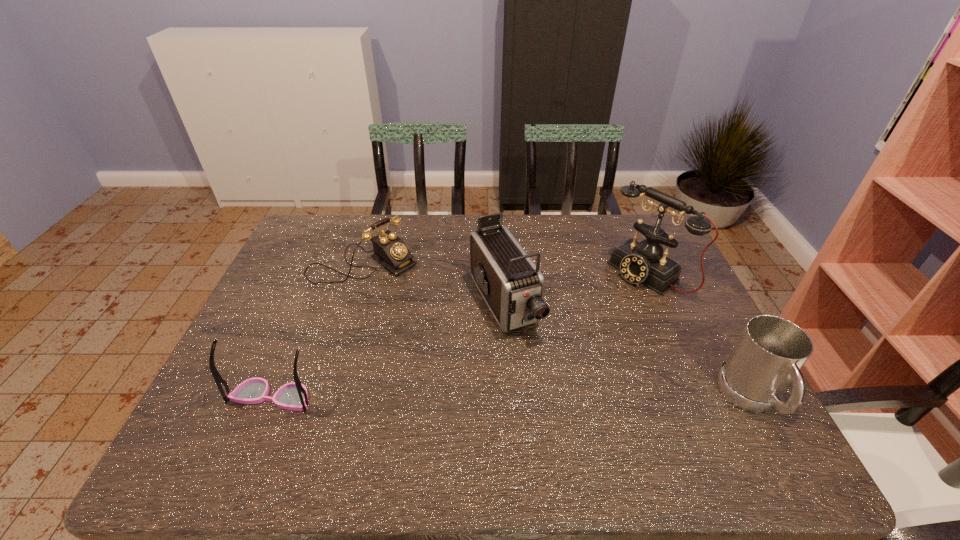
This screenshot has height=540, width=960. I want to click on blank region between the mug and the left telephone, so click(557, 332).

This screenshot has width=960, height=540. What are the coordinates of `object that is the closest to the spectacles` in the screenshot? It's located at (390, 251).

In order to click on object that is the third closest to the mug in this screenshot , I will do `click(390, 251)`.

Where is `vacant space that satisfies the following two spatial constraints: 1. on the back side of the camcorder; 2. on the left side of the right telephone`? vacant space that satisfies the following two spatial constraints: 1. on the back side of the camcorder; 2. on the left side of the right telephone is located at coordinates (503, 275).

Where is `free space that satisfies the following two spatial constraints: 1. on the back side of the spectacles; 2. on the right side of the shorter telephone`? This screenshot has width=960, height=540. free space that satisfies the following two spatial constraints: 1. on the back side of the spectacles; 2. on the right side of the shorter telephone is located at coordinates (327, 264).